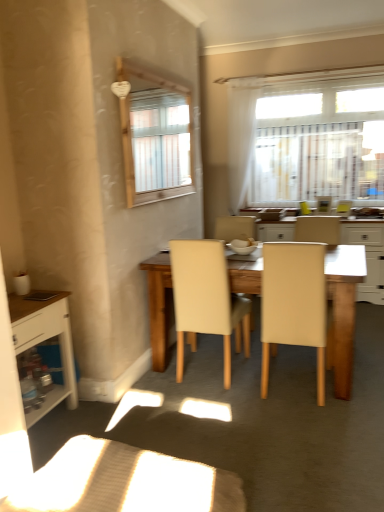
Question: Is light beige leather table at center to the left of beige leather chair at center, placed as the 2th chair when sorted from left to right, from the viewer's perspective?

Choices:
 (A) yes
 (B) no

Answer: (B)

Question: Is light beige leather table at center aimed at beige leather chair at center, placed as the 2th chair when sorted from left to right?

Choices:
 (A) no
 (B) yes

Answer: (B)

Question: From the image's perspective, is light beige leather table at center above beige leather chair at center, the first chair in the right-to-left sequence?

Choices:
 (A) yes
 (B) no

Answer: (A)

Question: Is the depth of light beige leather table at center greater than that of beige leather chair at center, the first chair in the right-to-left sequence?

Choices:
 (A) no
 (B) yes

Answer: (B)

Question: Is light beige leather table at center positioned with its back to beige leather chair at center, the first chair in the right-to-left sequence?

Choices:
 (A) no
 (B) yes

Answer: (A)

Question: Can you confirm if light beige leather table at center is wider than beige leather chair at center, placed as the 2th chair when sorted from left to right?

Choices:
 (A) yes
 (B) no

Answer: (B)

Question: Does white glossy bowl at center come in front of white wood cabinet at left?

Choices:
 (A) no
 (B) yes

Answer: (A)

Question: Does white glossy bowl at center contain white wood cabinet at left?

Choices:
 (A) no
 (B) yes

Answer: (A)

Question: Considering the relative sizes of white glossy bowl at center and white wood cabinet at left in the image provided, is white glossy bowl at center thinner than white wood cabinet at left?

Choices:
 (A) no
 (B) yes

Answer: (B)

Question: Is white glossy bowl at center turned away from white wood cabinet at left?

Choices:
 (A) yes
 (B) no

Answer: (B)

Question: Is white glossy bowl at center taller than white wood cabinet at left?

Choices:
 (A) no
 (B) yes

Answer: (A)

Question: Is white glossy bowl at center bigger than white wood cabinet at left?

Choices:
 (A) no
 (B) yes

Answer: (A)

Question: Is white wood cabinet at left completely or partially outside of white sheer curtain at upper center?

Choices:
 (A) yes
 (B) no

Answer: (A)